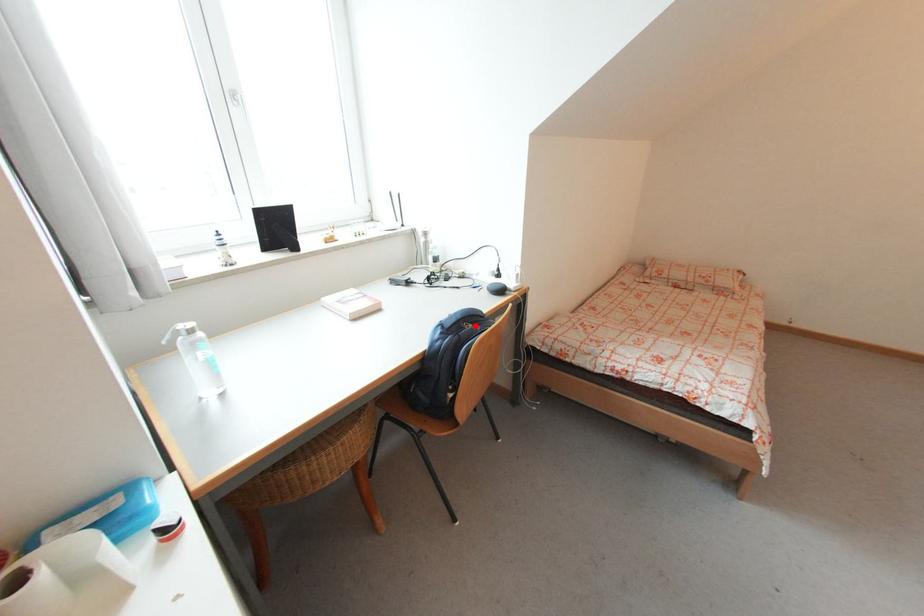
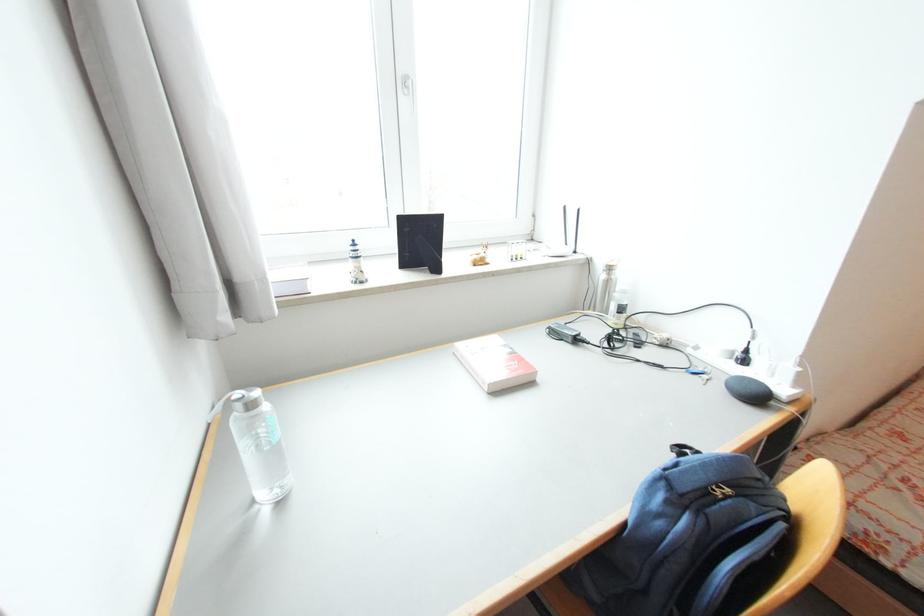
The point at the highlighted location is marked in the first image. Where is the corresponding point in the second image?

(734, 492)